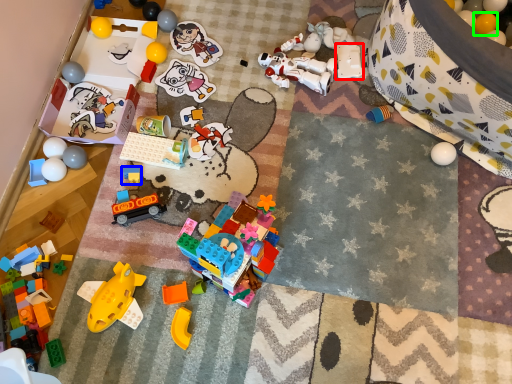
Question: Based on their relative distances, which object is farther from toy (highlighted by a red box)? Choose from toy (highlighted by a blue box) and toy (highlighted by a green box).

Choices:
 (A) toy
 (B) toy

Answer: (A)